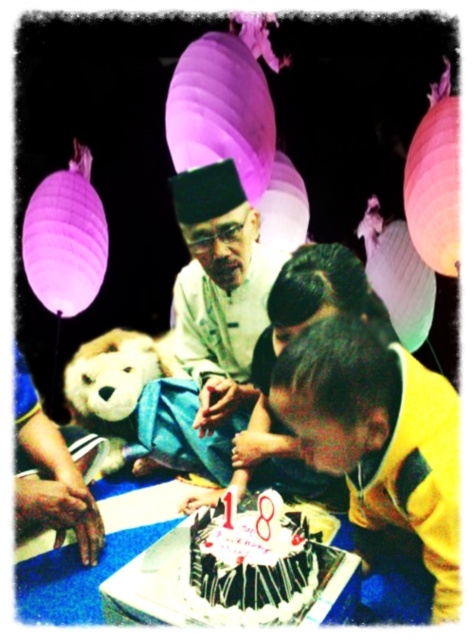
Is yellow fabric shirt at lower right positioned behind white paper cake at center?

Yes, yellow fabric shirt at lower right is behind white paper cake at center.

Is yellow fabric shirt at lower right bigger than white paper cake at center?

Correct, yellow fabric shirt at lower right is larger in size than white paper cake at center.

Between point (427, 556) and point (301, 554), which one is positioned behind?

Point (427, 556)

At what (x,y) coordinates should I click in order to perform the action: click on yellow fabric shirt at lower right. Please return your answer as a coordinate pair (x, y). The height and width of the screenshot is (640, 474). Looking at the image, I should click on (380, 436).

Does white silk shirt at center have a greater width compared to white paper cake at center?

Correct, the width of white silk shirt at center exceeds that of white paper cake at center.

Does white silk shirt at center appear over white paper cake at center?

Indeed, white silk shirt at center is positioned over white paper cake at center.

Measure the distance between white silk shirt at center and camera.

white silk shirt at center is 5.39 feet away from camera.

Identify the location of white silk shirt at center. This screenshot has height=640, width=474. (219, 289).

Is white paper cake at center to the left of fluffy white teddy bear at lower left from the viewer's perspective?

Incorrect, white paper cake at center is not on the left side of fluffy white teddy bear at lower left.

Is point (283, 522) more distant than point (100, 412)?

No, (283, 522) is in front of (100, 412).

Image resolution: width=474 pixels, height=640 pixels. I want to click on white paper cake at center, so click(x=254, y=557).